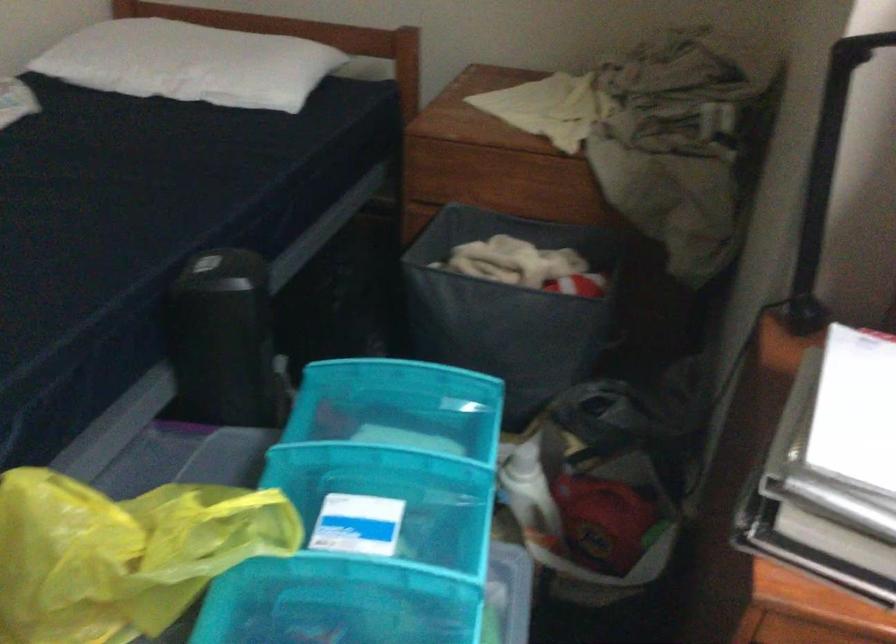
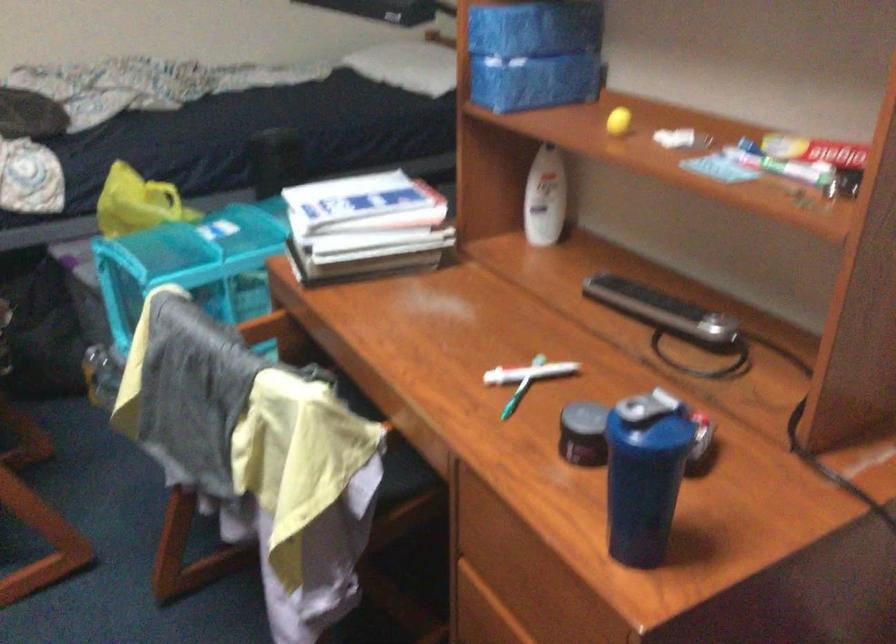
Question: I am providing you with two images of the same scene from different viewpoints. Please identify which objects are invisible in image2.

Choices:
 (A) white toothbrush
 (B) dark door handle
 (C) red detergent bottle
 (D) blue shaker cup

Answer: (C)